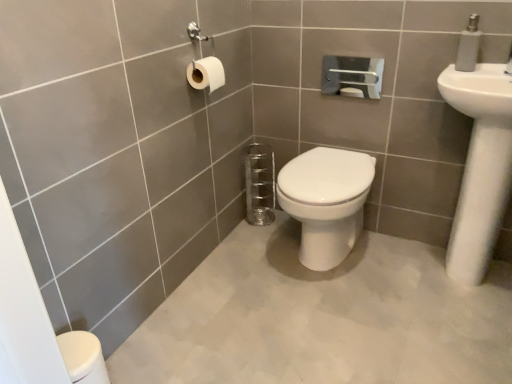
The width and height of the screenshot is (512, 384). I want to click on vacant region to the left of white glossy sink at upper right, so click(x=388, y=286).